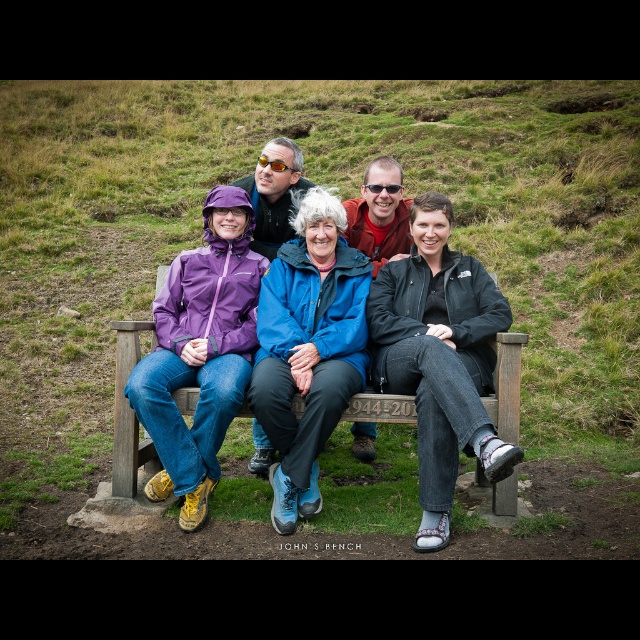
You are standing in front of the wooden bench where the five people are sitting. There are two points marked on the ground near the bench. One is at coordinates point (420, 420) and the other is at point (166, 323). Which of these two points is closer to you?

Point (420, 420) is closer to the viewer than point (166, 323).

Consider the image. You are standing at the starting point and need to reach the destination point. The path goes through the grassy area with patches of dirt. Which point should you head towards first, point (x=250, y=282) or point (x=509, y=513)?

You should head towards point (x=509, y=513) first because point (x=250, y=282) is behind it, so you need to pass point (x=509, y=513) before reaching the other point.

You are standing in front of the wooden bench where the group is sitting. You need to find the purple waterproof jacket at center. Based on the coordinates given, where should you look relative to the bench?

The purple waterproof jacket at center is located at the coordinates point (307,352), which would be near the middle section of the bench.